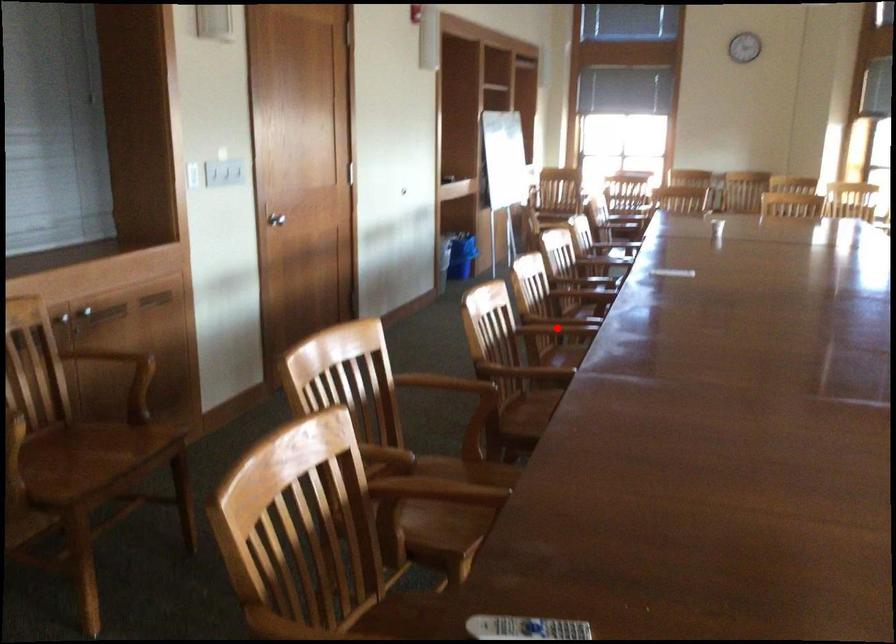
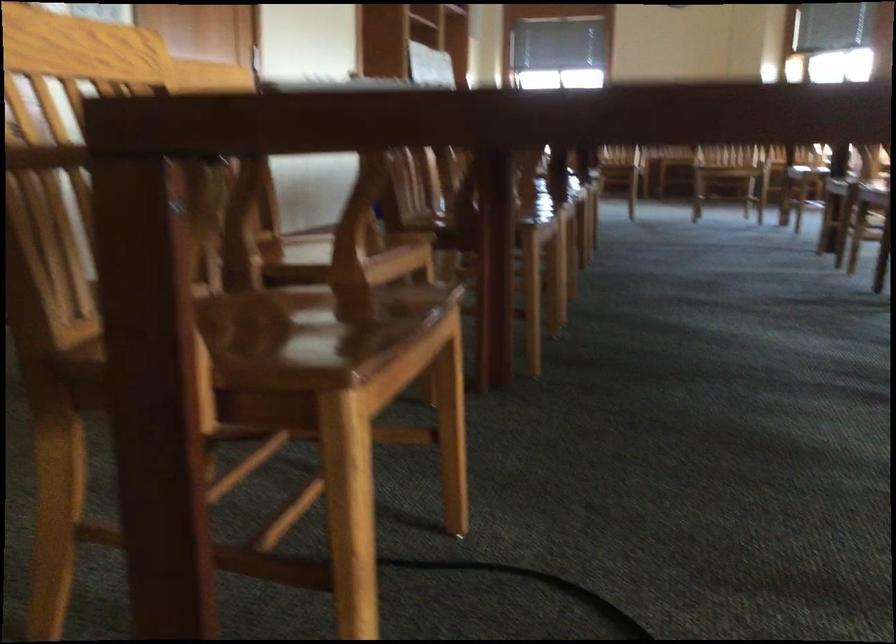
Question: I am providing you with two images of the same scene from different viewpoints. A red point is marked on the first image. Can you still see the location of the red point in image 2?

Choices:
 (A) Yes
 (B) No

Answer: (B)